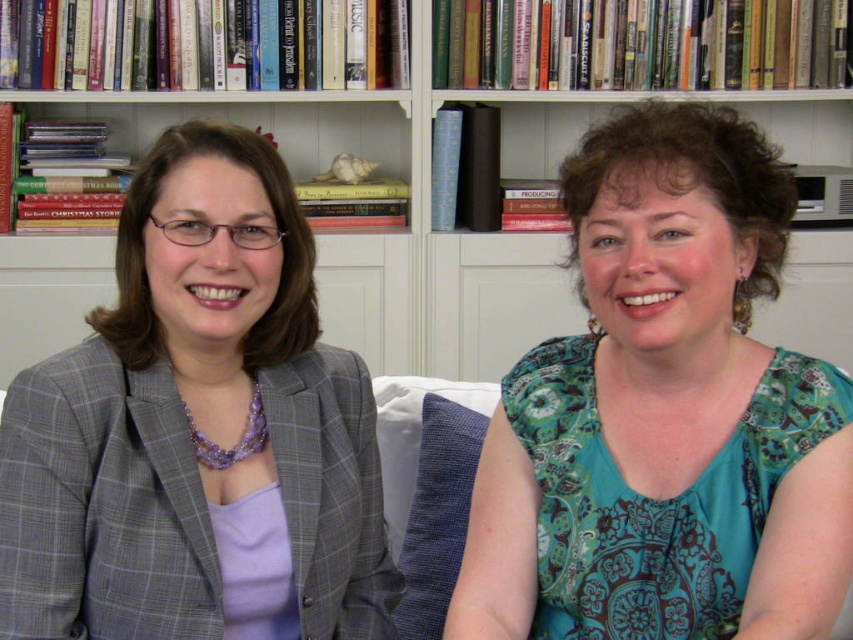
Who is more forward, (573, 477) or (316, 484)?

Point (573, 477) is in front.

Between point (676, 604) and point (241, 337), which one is positioned in front?

Point (676, 604)

Image resolution: width=853 pixels, height=640 pixels. Identify the location of teal paisley blouse at center. (663, 412).

Is teal paisley blouse at center smaller than wooden bookshelf at upper center?

Yes.

Is point (817, 420) farther from camera compared to point (6, 356)?

That is False.

You are a GUI agent. You are given a task and a screenshot of the screen. Output one action in this format:
    pyautogui.click(x=<x>, y=<y>)
    Task: Click on the teal paisley blouse at center
    This screenshot has width=853, height=640.
    Given the screenshot: What is the action you would take?
    pyautogui.click(x=663, y=412)

Who is shorter, gray checkered blazer at left or wooden bookshelf at upper center?

gray checkered blazer at left is shorter.

Is point (194, 428) positioned in front of point (512, 176)?

Yes, it is.

Where is `gray checkered blazer at left`? gray checkered blazer at left is located at coordinates (196, 429).